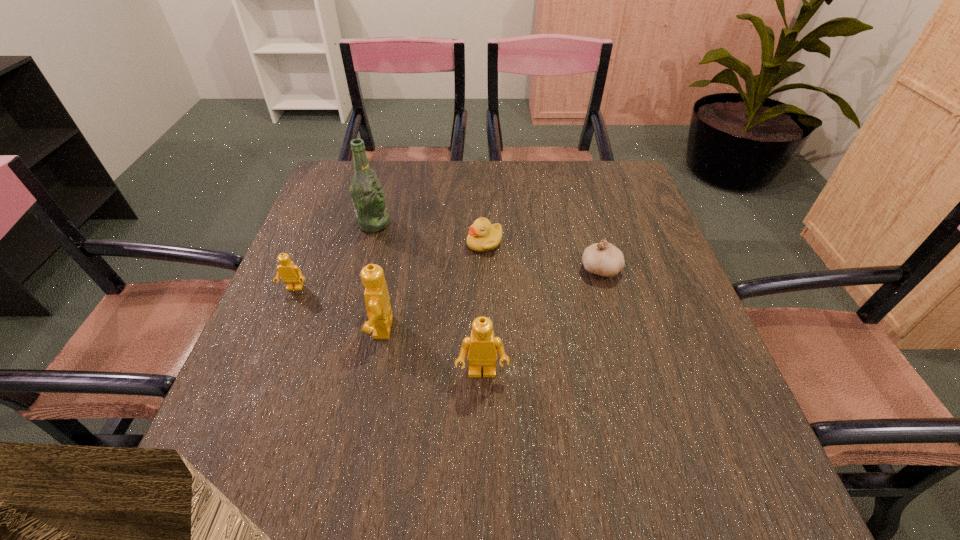
The height and width of the screenshot is (540, 960). In order to click on vacant space located 0.340m on the face of the farthest Lego in this screenshot , I will do `click(233, 440)`.

Locate an element on the screen. Image resolution: width=960 pixels, height=540 pixels. vacant space located on the face of the second farthest Lego is located at coordinates [267, 327].

What are the coordinates of `vacant space located on the face of the second farthest Lego` in the screenshot? It's located at (271, 327).

In order to click on vacant space located 0.200m on the face of the second farthest Lego in this screenshot , I will do `click(271, 327)`.

Find the location of a particular element. This screenshot has height=540, width=960. vacant region located on the face of the fourth shortest object is located at coordinates (482, 425).

You are a GUI agent. You are given a task and a screenshot of the screen. Output one action in this format:
    pyautogui.click(x=<x>, y=<y>)
    Task: Click on the vacant area located on the front of the rightmost object
    The image size is (960, 540).
    Given the screenshot: What is the action you would take?
    pyautogui.click(x=646, y=433)

The image size is (960, 540). In order to click on free spot located 0.320m on the beak of the shortest object in this screenshot , I will do `click(341, 242)`.

Locate an element on the screen. This screenshot has width=960, height=540. free space located on the beak of the shortest object is located at coordinates (321, 242).

You are a GUI agent. You are given a task and a screenshot of the screen. Output one action in this format:
    pyautogui.click(x=<x>, y=<y>)
    Task: Click on the vacant space located 0.130m on the beak of the shortest object
    This screenshot has height=540, width=960.
    Given the screenshot: What is the action you would take?
    coord(416,242)

At what (x,y) coordinates should I click in order to perform the action: click on vacant space located on the surface of the second object from left to right. Please return your answer as a coordinate pair (x, y). Looking at the image, I should click on (439, 224).